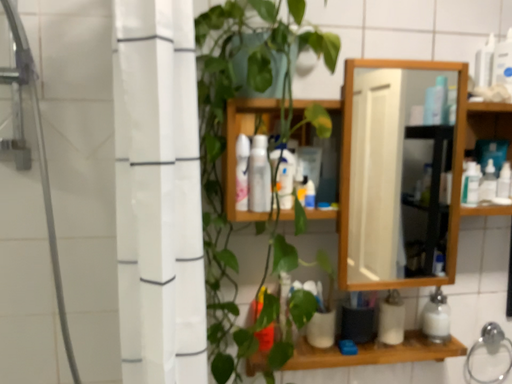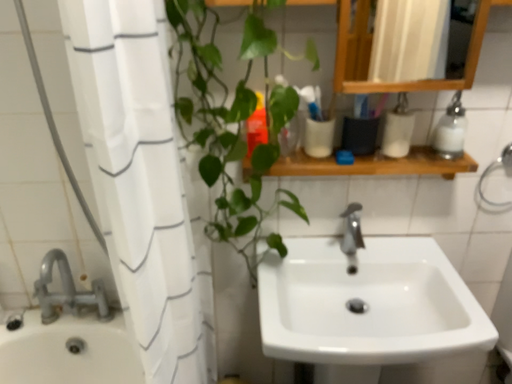
Question: How did the camera likely rotate when shooting the video?

Choices:
 (A) rotated left
 (B) rotated right

Answer: (A)